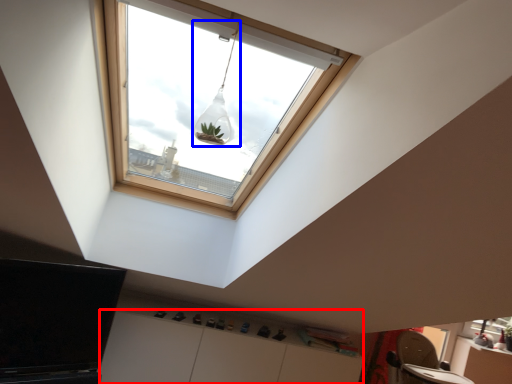
Question: Among these objects, which one is farthest to the camera, cabinetry (highlighted by a red box) or light fixture (highlighted by a blue box)?

Choices:
 (A) cabinetry
 (B) light fixture

Answer: (A)